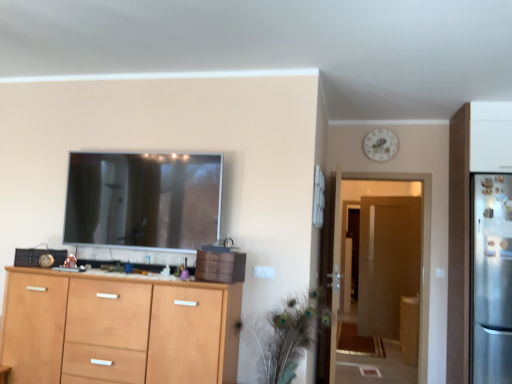
Question: Is satin silver refrigerator at right placed right next to light wood cabinet at lower left, marked as the 1th cabinetry in a left-to-right arrangement?

Choices:
 (A) yes
 (B) no

Answer: (B)

Question: Is satin silver refrigerator at right smaller than light wood cabinet at lower left, the 1th cabinetry from the front?

Choices:
 (A) no
 (B) yes

Answer: (B)

Question: Is satin silver refrigerator at right looking in the opposite direction of light wood cabinet at lower left, marked as the 1th cabinetry in a left-to-right arrangement?

Choices:
 (A) no
 (B) yes

Answer: (A)

Question: Would you say satin silver refrigerator at right is a long distance from light wood cabinet at lower left, marked as the 1th cabinetry in a left-to-right arrangement?

Choices:
 (A) no
 (B) yes

Answer: (B)

Question: Does satin silver refrigerator at right come behind light wood cabinet at lower left, which ranks as the second cabinetry in bottom-to-top order?

Choices:
 (A) yes
 (B) no

Answer: (A)

Question: Is satin silver refrigerator at right to the right of light wood cabinet at lower left, the 2th cabinetry in the back-to-front sequence, from the viewer's perspective?

Choices:
 (A) no
 (B) yes

Answer: (B)

Question: Is wooden cabinet at right, which is the second cabinetry from top to bottom, not within wooden cabinet at center?

Choices:
 (A) no
 (B) yes

Answer: (B)

Question: Does wooden cabinet at right, which is the second cabinetry from top to bottom, turn towards wooden cabinet at center?

Choices:
 (A) yes
 (B) no

Answer: (B)

Question: Considering the relative positions of wooden cabinet at right, the second cabinetry positioned from the front, and wooden cabinet at center in the image provided, is wooden cabinet at right, the second cabinetry positioned from the front, behind wooden cabinet at center?

Choices:
 (A) yes
 (B) no

Answer: (A)

Question: Is wooden cabinet at right, which is the second cabinetry from top to bottom, taller than wooden cabinet at center?

Choices:
 (A) yes
 (B) no

Answer: (A)

Question: Considering the relative sizes of wooden cabinet at right, arranged as the second cabinetry when viewed from the left, and wooden cabinet at center in the image provided, is wooden cabinet at right, arranged as the second cabinetry when viewed from the left, shorter than wooden cabinet at center?

Choices:
 (A) no
 (B) yes

Answer: (A)

Question: Is wooden cabinet at right, the second cabinetry positioned from the front, facing away from wooden cabinet at center?

Choices:
 (A) no
 (B) yes

Answer: (A)

Question: From a real-world perspective, does satin silver refrigerator at right stand above transparent glass door at center?

Choices:
 (A) yes
 (B) no

Answer: (A)